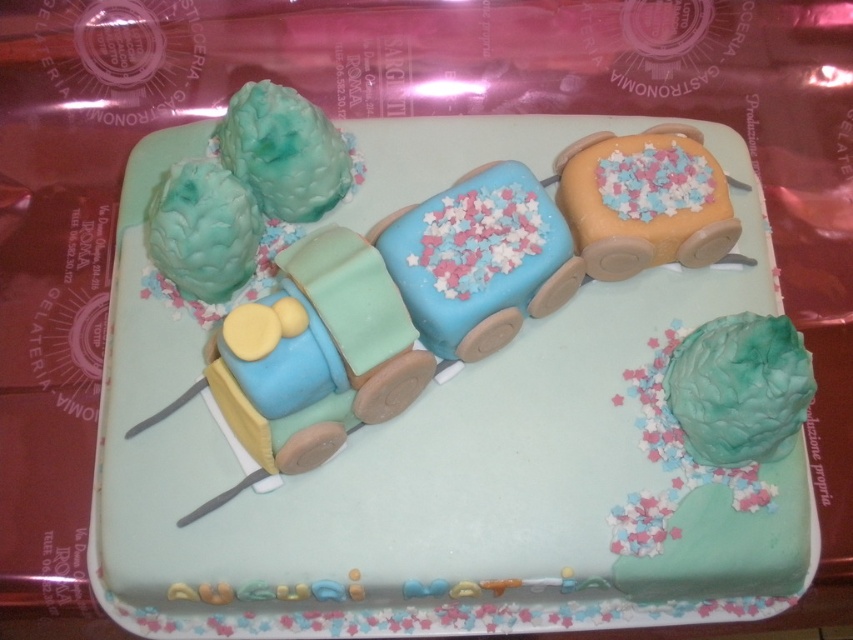
You are a customer at a bakery and see the matte fondant train at center and the orange frosted train car at upper right displayed on the counter. Which one is placed lower on the counter?

The matte fondant train at center is positioned under the orange frosted train car at upper right, so it is placed lower on the counter.

You are a guest at a birthday party and see the matte fondant train at center and the orange frosted train car at upper right on the cake. Which of these two items is positioned more to the left side of the cake?

The matte fondant train at center is positioned more to the left side of the cake than the orange frosted train car at upper right.

You are a cake decorator who needs to place a small chocolate figurine on the cake. The figurine is 3 inches wide. Which of the two train carriages, the blue fondant train at center or the orange frosted train car at upper right, has enough space to accommodate the figurine without overlapping other decorations?

The blue fondant train at center has a larger width than the orange frosted train car at upper right. Since the figurine is 3 inches wide, the blue fondant train at center likely provides sufficient space to place the figurine without overlapping decorations, whereas the orange frosted train car at upper right may be too narrow.